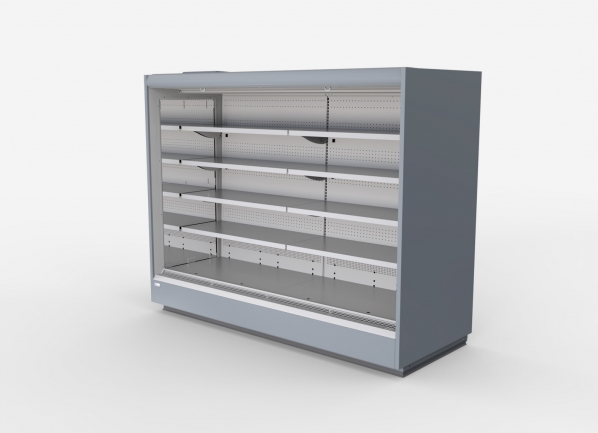
Find the location of a particular element. The image size is (598, 433). right side of cabinet is located at coordinates (440, 190).